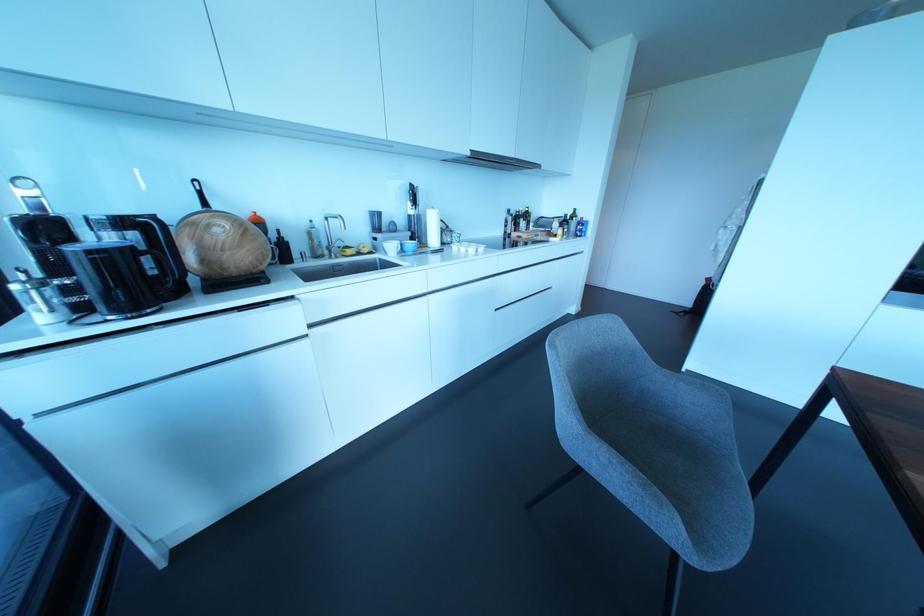
The height and width of the screenshot is (616, 924). Describe the element at coordinates (200, 193) in the screenshot. I see `the black pan handle` at that location.